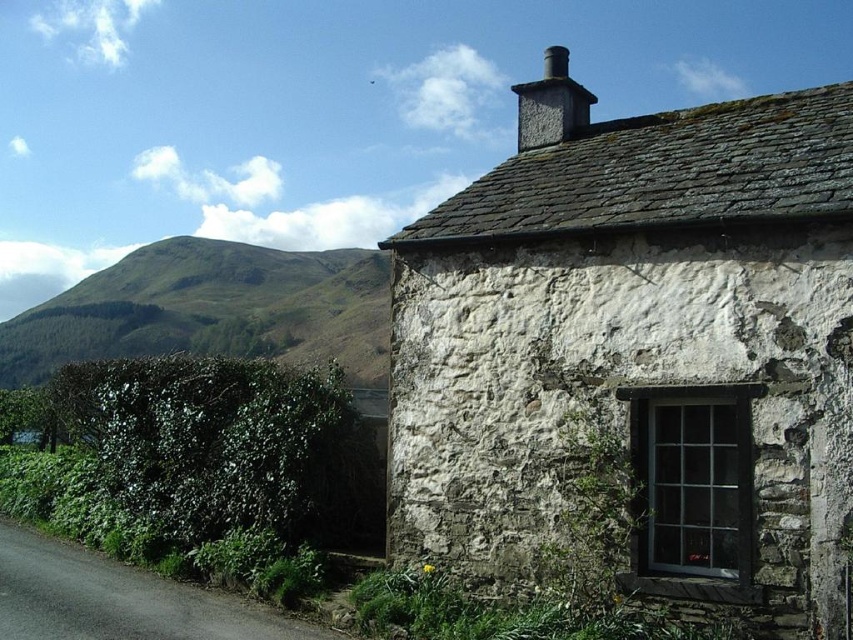
You are standing in front of the stone cottage and want to determine the relative positions of two points marked on the ground. Which of the two points, point (498, 417) or point (254, 307), is closer to you?

Point (498, 417) is closer to the viewer than point (254, 307).

You are standing in front of the cottage and want to take a photo that includes both the green grassy hillside at upper left and the gray stone chimney at upper center. Which direction should you position yourself relative to the cottage to ensure both are visible in the frame?

You should position yourself to the left of the cottage so that the green grassy hillside at upper left and the gray stone chimney at upper center are both visible in the frame.